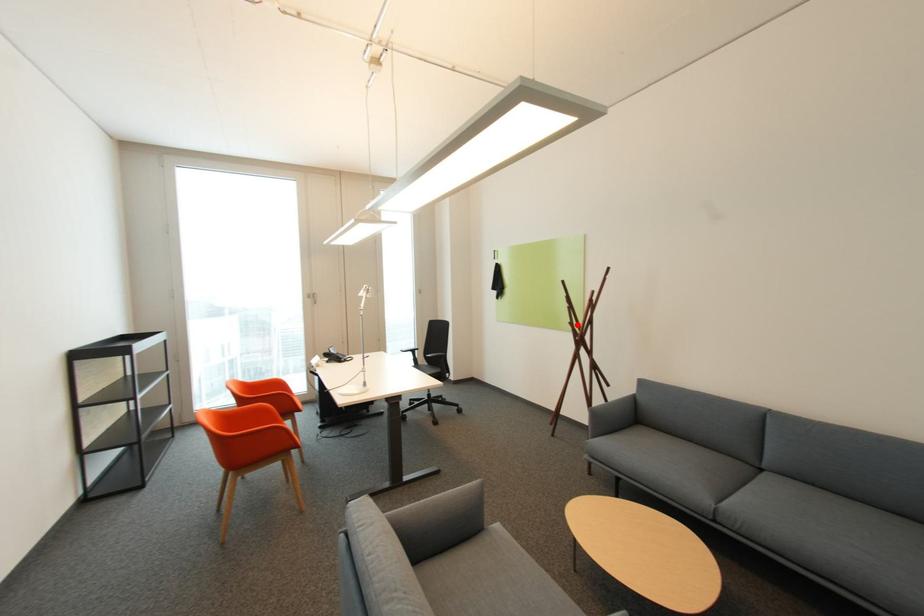
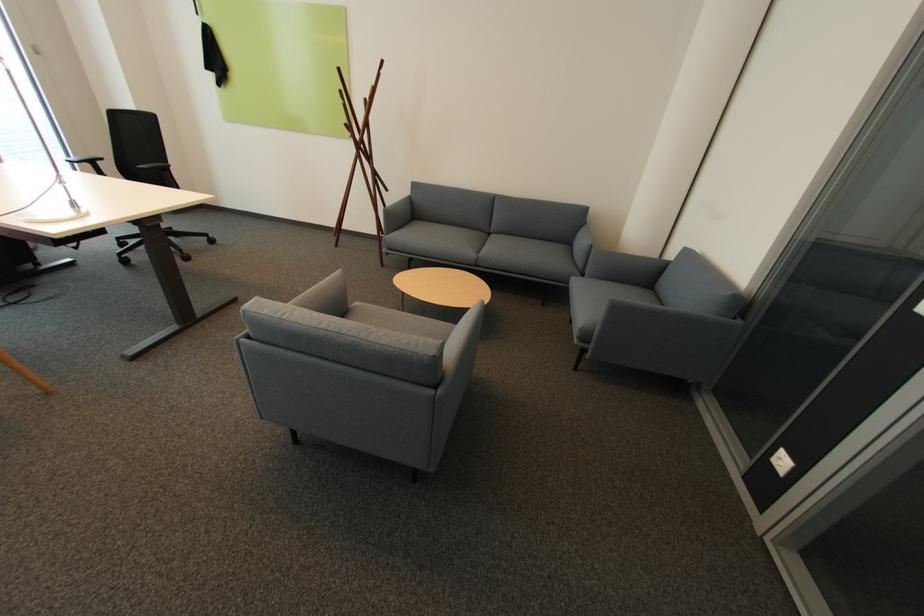
In the second image, find the point that corresponds to the highlighted location in the first image.

(355, 126)